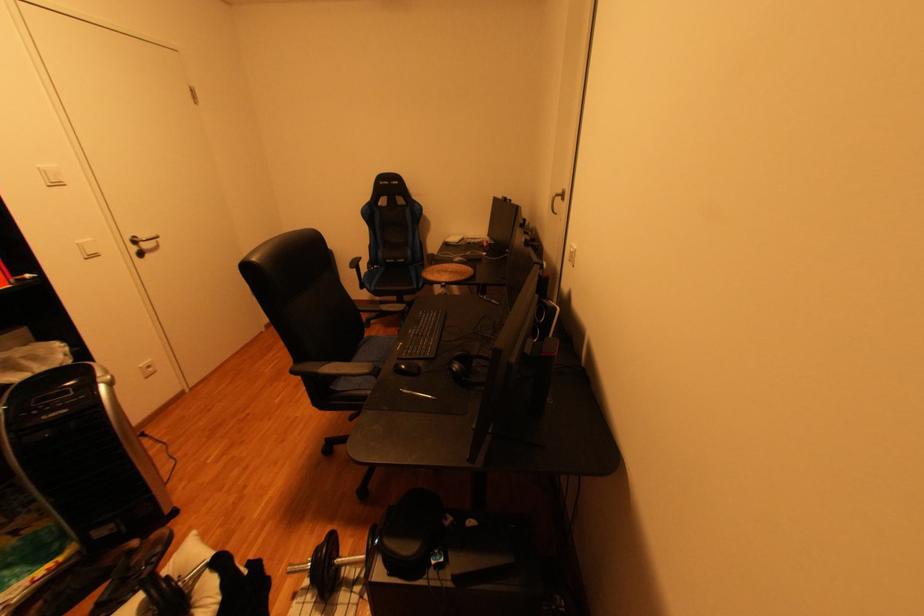
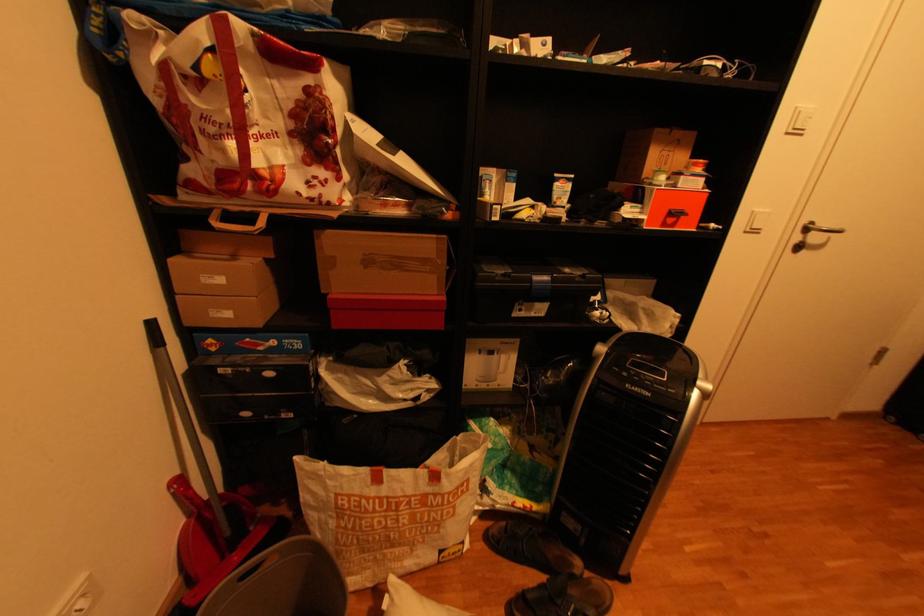
The first image is from the beginning of the video and the second image is from the end. How did the camera likely rotate when shooting the video?

The camera's rotation is toward left-down.